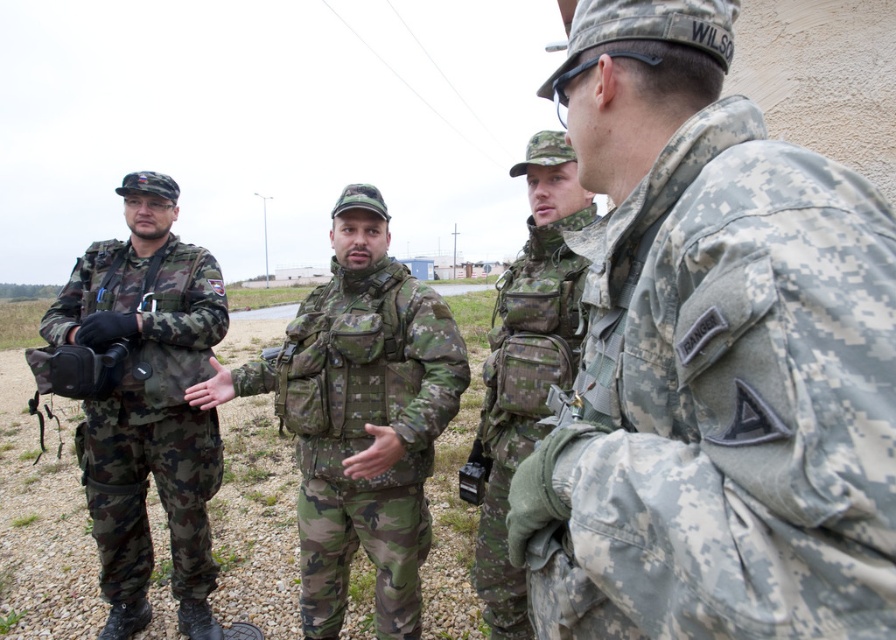
You are a photographer standing at the far left, holding a camera. You want to take a photo of the camouflage fabric uniform at center. Can you reach it with your camera without moving?

The camouflage fabric uniform at center is 2.04 meters away from you. Since most cameras can focus on subjects within that distance, you can take the photo without moving.

You are an observer standing in front of the group. Which clothing item, the camouflage fabric jacket at center or the camouflage fabric uniform at left, appears narrower?

The camouflage fabric jacket at center has a lesser width compared to the camouflage fabric uniform at left, so the camouflage fabric jacket at center appears narrower.